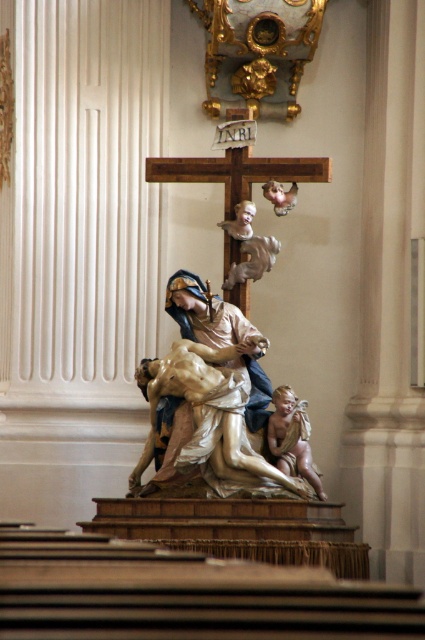
Looking at the church interior scene, there is a polished marble statue at center and a smooth beige cherub at center. Which object is positioned to the left side of the other?

The polished marble statue at center is to the left of the smooth beige cherub at center.

You are an art student standing in front of the sculpture group. You want to take a photo of both the polished marble statue at center and the polished silver cherub at upper center. However, your camera can only focus on objects at a certain distance. Based on their positions, which object should you focus on first to ensure both are in the frame?

The polished marble statue at center is closer to the viewer than the polished silver cherub at upper center. To ensure both are in focus, you should focus on the polished marble statue at center first since it is closer, and adjust the focus to include the farther cherub.